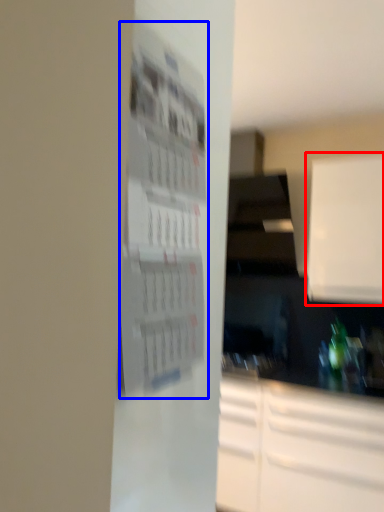
Question: Among these objects, which one is nearest to the camera, cabinetry (highlighted by a red box) or bulletin board (highlighted by a blue box)?

Choices:
 (A) cabinetry
 (B) bulletin board

Answer: (B)